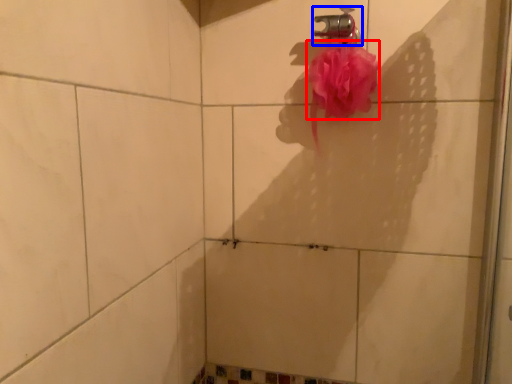
Question: Which of the following is the closest to the observer, blood (highlighted by a red box) or plumbing fixture (highlighted by a blue box)?

Choices:
 (A) blood
 (B) plumbing fixture

Answer: (A)